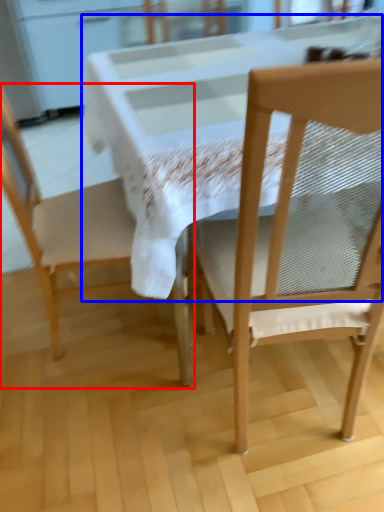
Question: Which object appears farthest to the camera in this image, chair (highlighted by a red box) or round table (highlighted by a blue box)?

Choices:
 (A) chair
 (B) round table

Answer: (A)